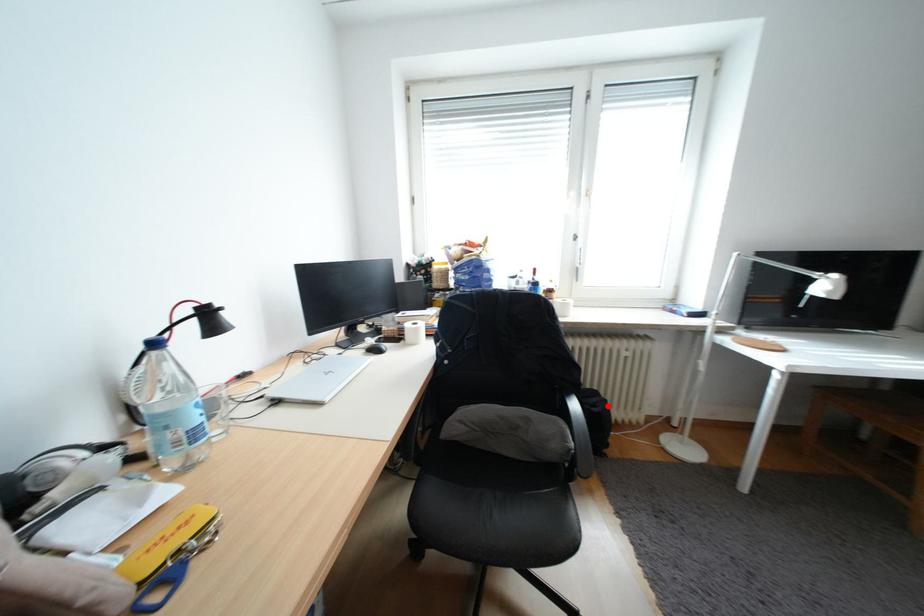
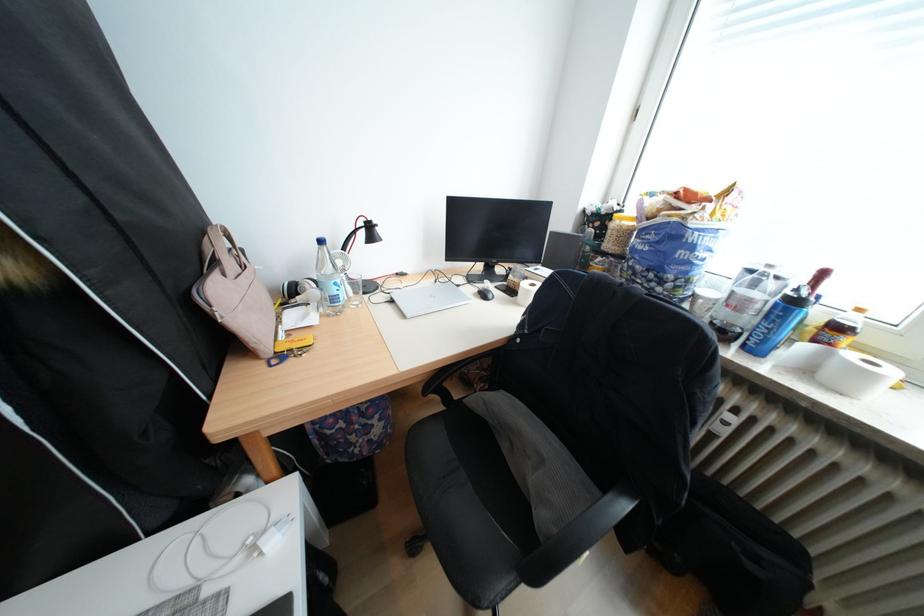
Question: I am providing you with two images of the same scene from different viewpoints. A red point is shown in image1. For the corresponding object point in image2, is it positioned nearer or farther from the camera?

Choices:
 (A) Nearer
 (B) Farther

Answer: (A)